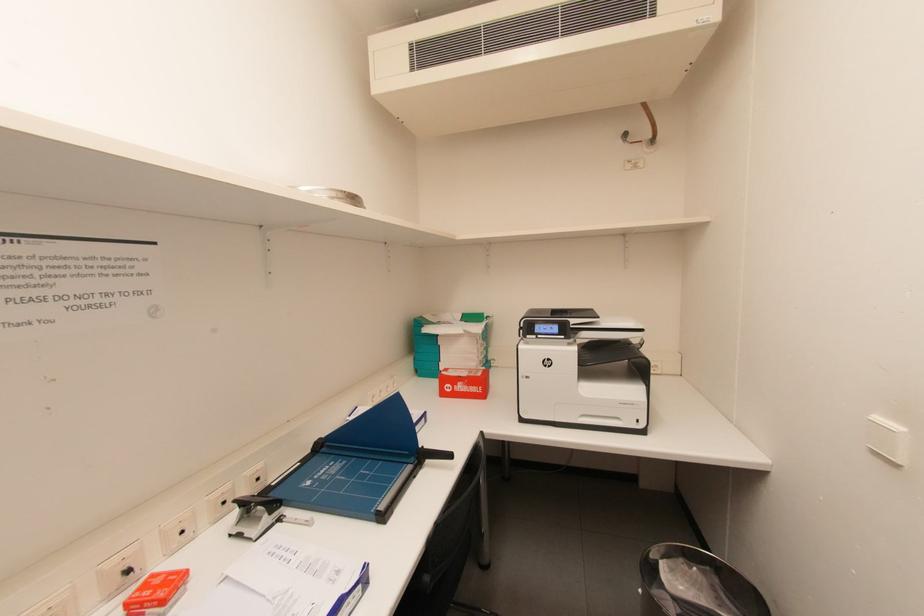
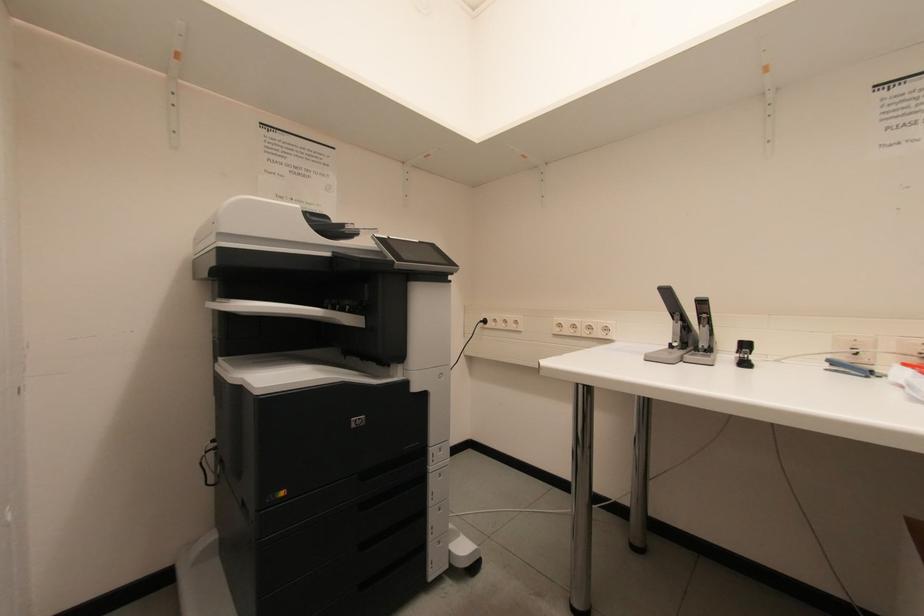
Question: Based on the continuous images, in which direction is the camera rotating? Reply with the corresponding letter.

Choices:
 (A) Left
 (B) Right
 (C) Up
 (D) Down

Answer: (A)